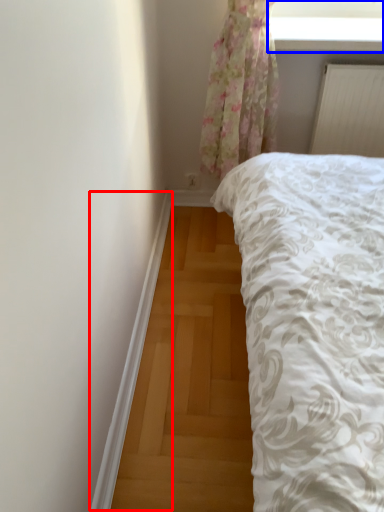
Question: Which object appears closest to the camera in this image, trim (highlighted by a red box) or window screen (highlighted by a blue box)?

Choices:
 (A) trim
 (B) window screen

Answer: (A)